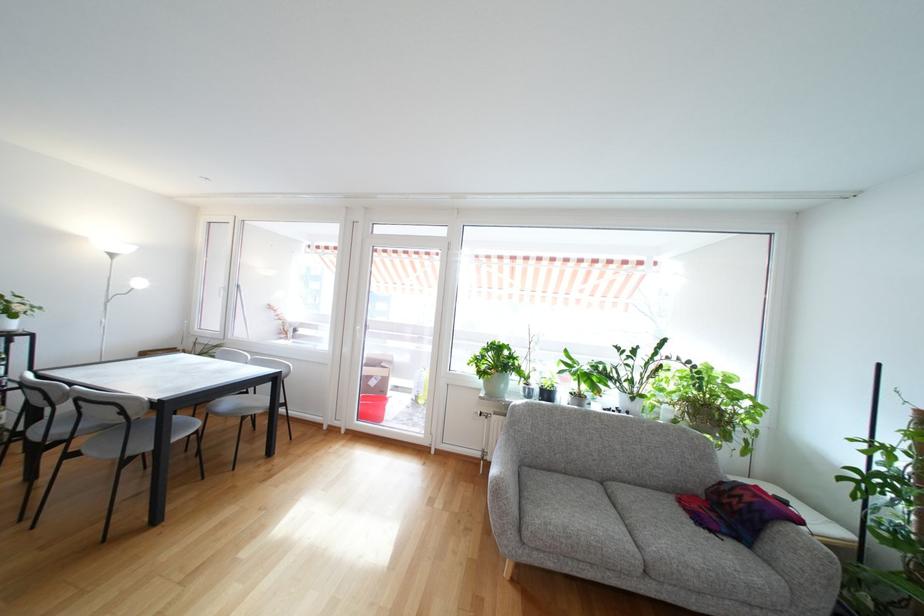
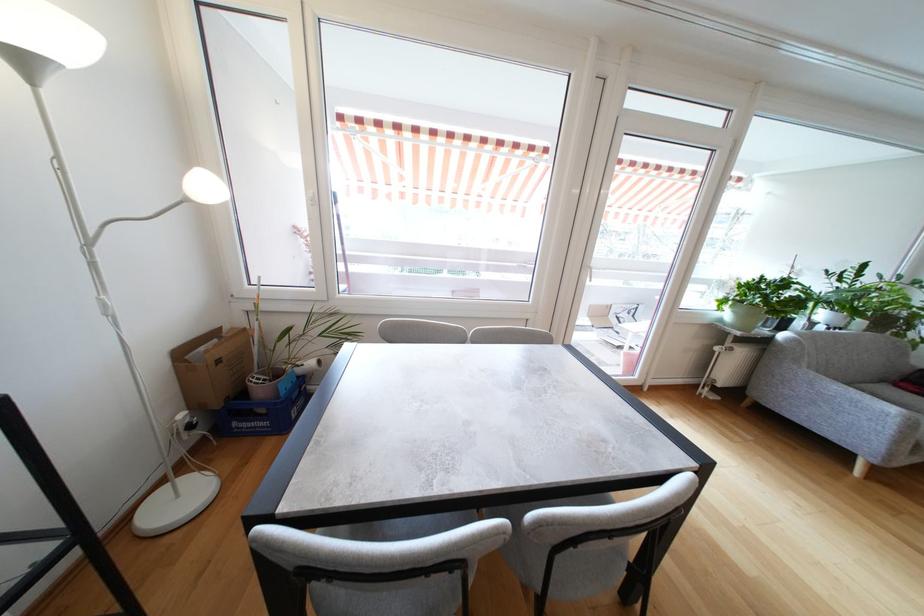
In the second image, find the point that corresponds to (x=227, y=291) in the first image.

(315, 201)